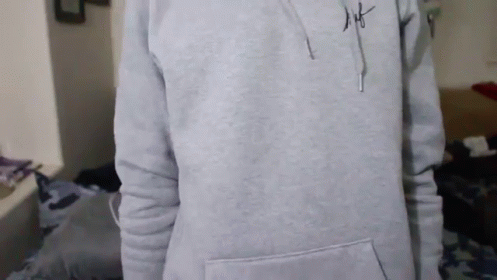
This screenshot has width=497, height=280. I want to click on silver sconce arm on the wall in the background toward the right, so click(433, 24).